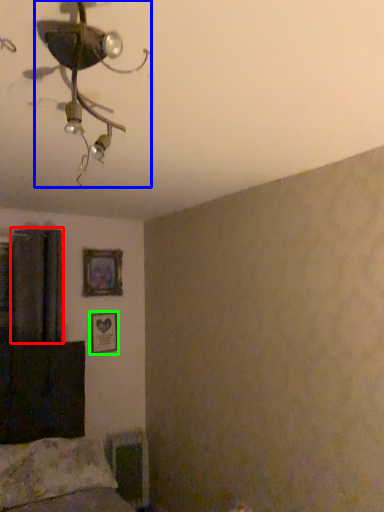
Question: Based on their relative distances, which object is farther from curtain (highlighted by a red box)? Choose from lamp (highlighted by a blue box) and picture frame (highlighted by a green box).

Choices:
 (A) lamp
 (B) picture frame

Answer: (A)